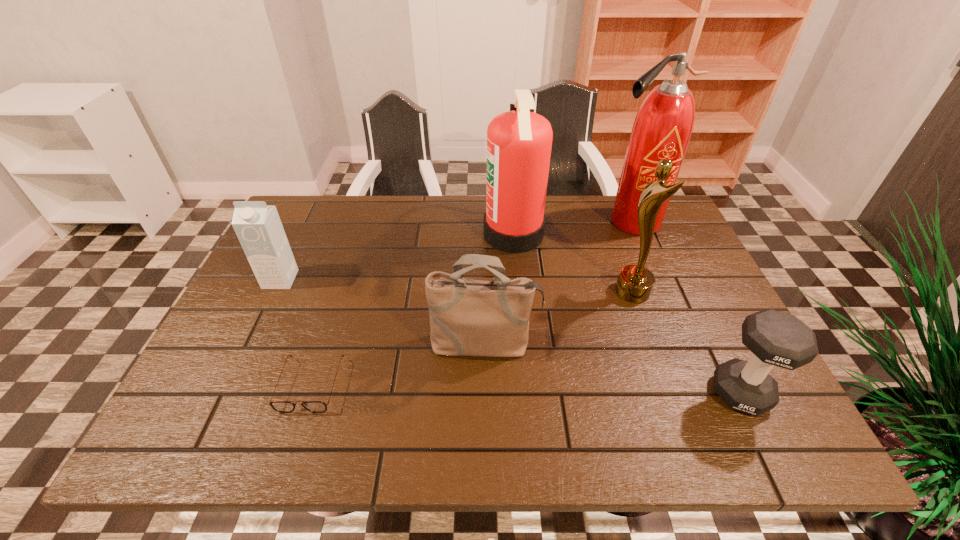
You are a GUI agent. You are given a task and a screenshot of the screen. Output one action in this format:
    pyautogui.click(x=<x>, y=<y>)
    Task: Click on the right fire extinguisher
    The width and height of the screenshot is (960, 540).
    Given the screenshot: What is the action you would take?
    pyautogui.click(x=662, y=128)

At what (x,y) coordinates should I click in order to perform the action: click on the left fire extinguisher. Please return your answer as a coordinate pair (x, y). Image resolution: width=960 pixels, height=540 pixels. Looking at the image, I should click on (519, 142).

Identify the location of award. (634, 284).

I want to click on shoulder bag, so click(x=468, y=317).

What are the coordinates of `the leftmost object` in the screenshot? It's located at (258, 227).

Where is `the sixth tallest object`? Image resolution: width=960 pixels, height=540 pixels. the sixth tallest object is located at coordinates (776, 338).

At what (x,y) coordinates should I click in order to perform the action: click on the sixth object from right to left. Please return your answer as a coordinate pair (x, y). This screenshot has width=960, height=540. Looking at the image, I should click on (280, 406).

Image resolution: width=960 pixels, height=540 pixels. In order to click on sunglasses in this screenshot , I will do `click(280, 406)`.

At what (x,y) coordinates should I click in order to perform the action: click on vacant space located on the front of the right fire extinguisher. Please return your answer as a coordinate pair (x, y). This screenshot has width=960, height=540. Looking at the image, I should click on (654, 275).

Identify the location of vacant space located at the nozzle of the left fire extinguisher. The image size is (960, 540). pos(429,234).